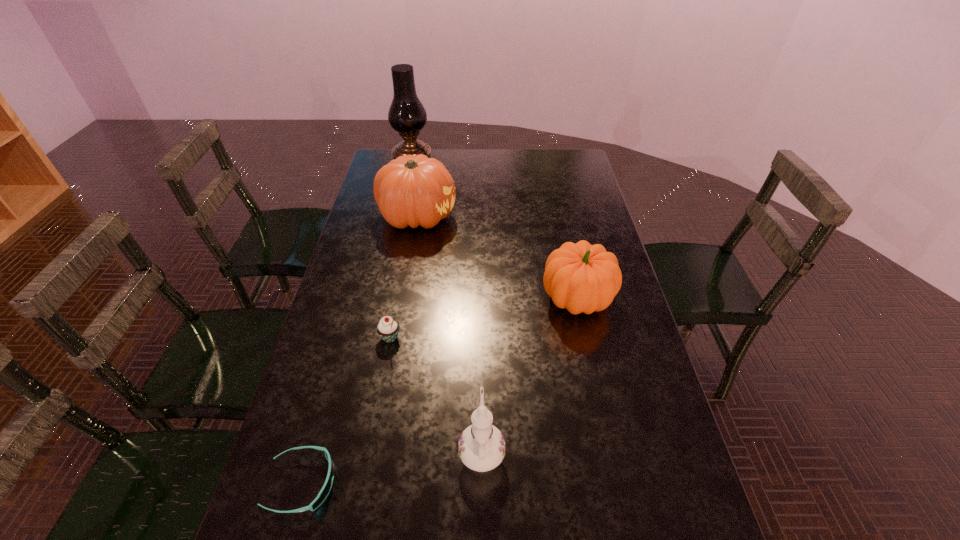
I want to click on blank area in the image that satisfies the following two spatial constraints: 1. on the carved face of the farther pumpkin; 2. at the spout of the chinaware, so (377, 451).

At what (x,y) coordinates should I click in order to perform the action: click on vacant space that satisfies the following two spatial constraints: 1. on the front side of the farthest object; 2. on the right side of the fourth farthest object. Please return your answer as a coordinate pair (x, y). The height and width of the screenshot is (540, 960). Looking at the image, I should click on (376, 338).

What are the coordinates of `free space that satisfies the following two spatial constraints: 1. on the front side of the rightmost object; 2. on the front-facing side of the shortest object` in the screenshot? It's located at (616, 483).

In order to click on free point that satisfies the following two spatial constraints: 1. on the carved face of the second farthest object; 2. on the back side of the shorter pumpkin in this screenshot , I will do `click(403, 299)`.

Locate an element on the screen. The height and width of the screenshot is (540, 960). vacant region that satisfies the following two spatial constraints: 1. on the front side of the oil lamp; 2. on the right side of the third nearest object is located at coordinates (376, 338).

Where is `free point that satisfies the following two spatial constraints: 1. on the carved face of the left pumpkin; 2. on the front side of the fifth tallest object`? free point that satisfies the following two spatial constraints: 1. on the carved face of the left pumpkin; 2. on the front side of the fifth tallest object is located at coordinates (397, 338).